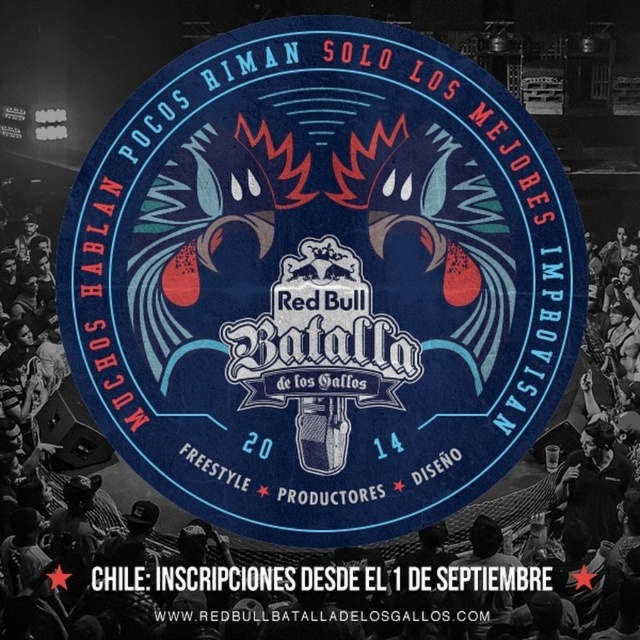
Looking at this image, you are a photographer at the event and want to capture the matte blue circular at center and the black fabric crowd at center in a single shot. Which object should be positioned to the left in your camera viewfinder?

The black fabric crowd at center should be positioned to the left in your camera viewfinder because the matte blue circular at center is to the right of it according to the description.

Based on the provided scene description, where is the matte blue circular at center located in terms of coordinates?

The matte blue circular at center is located at point coordinates of (x=321, y=280).